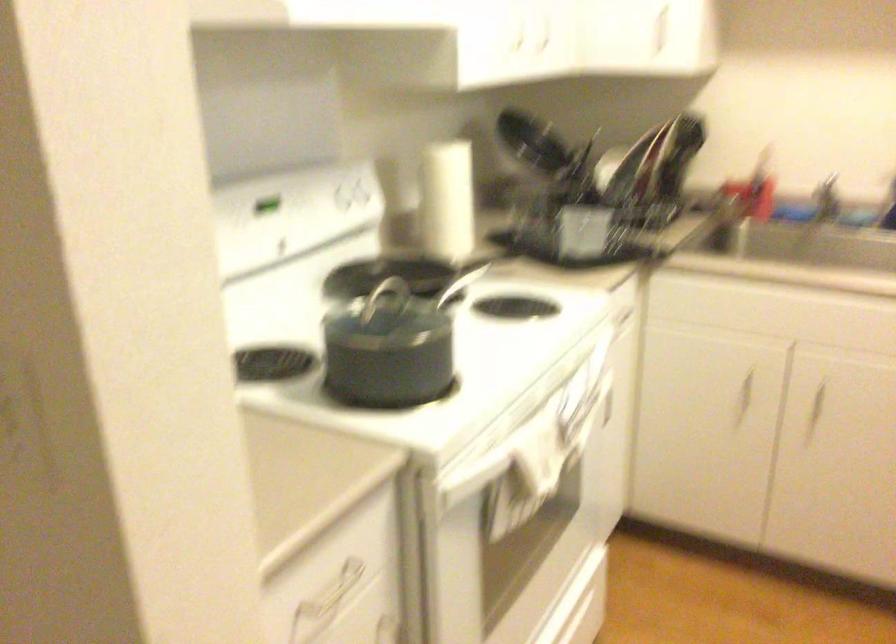
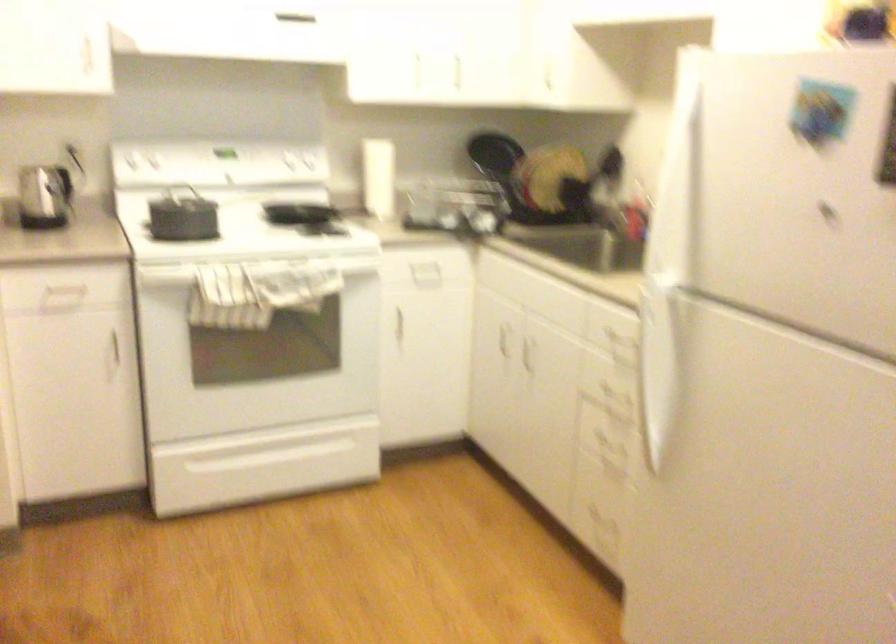
Where in the second image is the point corresponding to the point at 451,193 from the first image?

(377, 178)